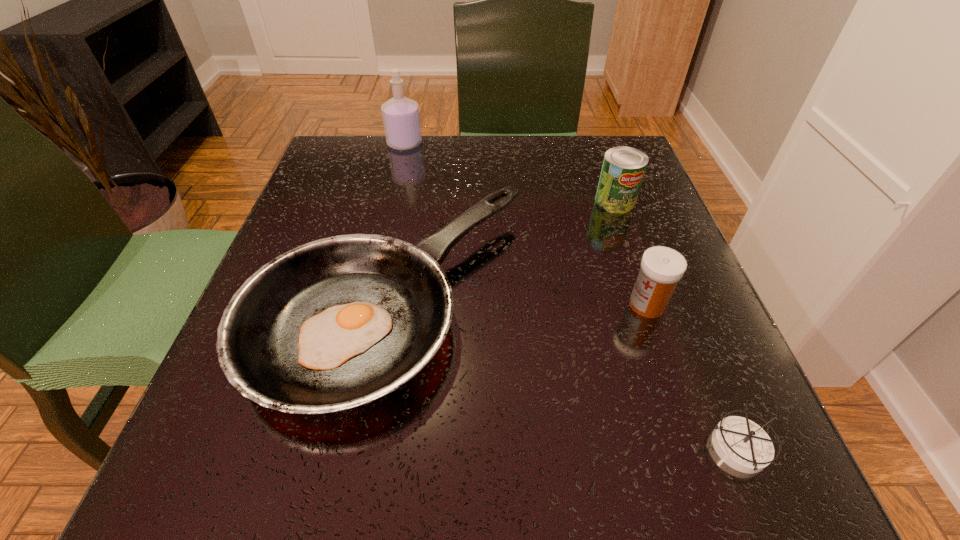
Locate an element on the screen. free space located 0.300m on the back of the compass is located at coordinates (662, 260).

This screenshot has height=540, width=960. Identify the location of perfume that is at the far edge. (401, 119).

I want to click on can at the far edge, so pyautogui.click(x=623, y=169).

This screenshot has height=540, width=960. Find the location of `frying pan positioned at the near edge`. frying pan positioned at the near edge is located at coordinates (336, 323).

Image resolution: width=960 pixels, height=540 pixels. Find the location of `compass present at the near edge`. compass present at the near edge is located at coordinates coord(742,444).

Identify the location of perfume that is at the left edge. (401, 119).

At what (x,y) coordinates should I click in order to perform the action: click on frying pan at the left edge. Please return your answer as a coordinate pair (x, y). Looking at the image, I should click on (336, 323).

Where is `can present at the right edge`? This screenshot has width=960, height=540. can present at the right edge is located at coordinates (623, 169).

At what (x,y) coordinates should I click in order to perform the action: click on medicine that is at the right edge. Please return your answer as a coordinate pair (x, y). Looking at the image, I should click on (661, 268).

Find the location of a particular element. compass present at the right edge is located at coordinates (742, 444).